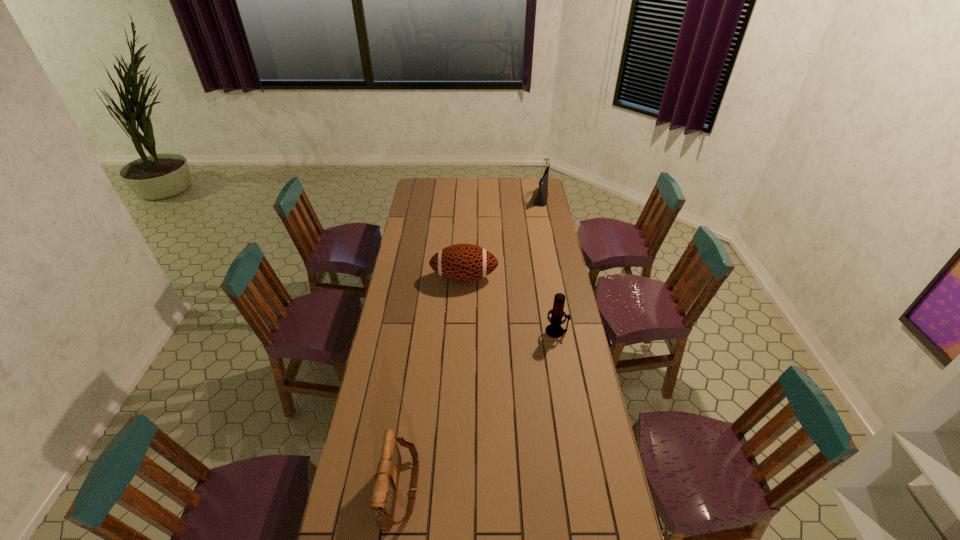
The width and height of the screenshot is (960, 540). Identify the location of free point between the microphone and the right shoulder bag. (549, 265).

You are a GUI agent. You are given a task and a screenshot of the screen. Output one action in this format:
    pyautogui.click(x=<x>, y=<y>)
    Task: Click on the free space that is in between the farthest object and the microphone
    The width and height of the screenshot is (960, 540).
    Given the screenshot: What is the action you would take?
    pyautogui.click(x=549, y=265)

Identify the location of unoccupied position between the nearest object and the right shoulder bag. This screenshot has height=540, width=960. (470, 345).

Find the location of a particular element. unoccupied position between the microphone and the nearer shoulder bag is located at coordinates (479, 410).

You are a GUI agent. You are given a task and a screenshot of the screen. Output one action in this format:
    pyautogui.click(x=<x>, y=<y>)
    Task: Click on the free space between the football and the tallest object
    This screenshot has height=540, width=960.
    Given the screenshot: What is the action you would take?
    pyautogui.click(x=502, y=238)

Identify the location of free point between the nearer shoulder bag and the football. This screenshot has height=540, width=960. (432, 384).

Image resolution: width=960 pixels, height=540 pixels. What are the coordinates of `free spot between the tallest object and the third nearest object` in the screenshot? It's located at (502, 238).

You are a GUI agent. You are given a task and a screenshot of the screen. Output one action in this format:
    pyautogui.click(x=<x>, y=<y>)
    Task: Click on the vacant space that's between the football and the taller shoulder bag
    
    Given the screenshot: What is the action you would take?
    click(502, 238)

In order to click on object that is the second closest to the third nearest object in this screenshot , I will do `click(540, 200)`.

Select which object is the third closest to the nearer shoulder bag. Please provide its 2D coordinates. Your answer should be formatted as a tuple, i.e. [(x, y)], where the tuple contains the x and y coordinates of a point satisfying the conditions above.

[(540, 200)]